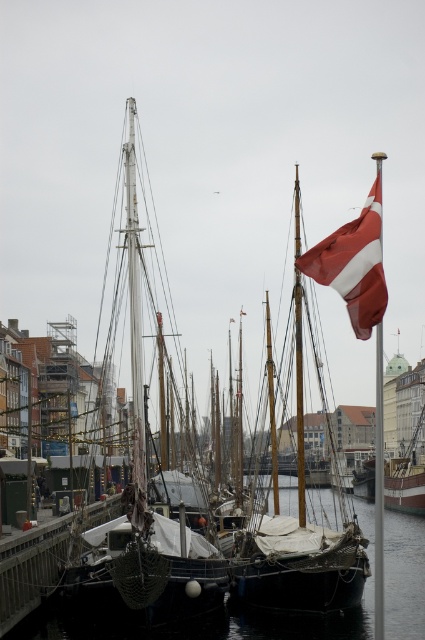
Who is positioned more to the left, red and white fabric sailboat at center or red fabric flag at upper right?

From the viewer's perspective, red and white fabric sailboat at center appears more on the left side.

Between point (297, 253) and point (333, 236), which one is positioned in front?

Point (333, 236)

Between point (255, 577) and point (348, 253), which one is positioned behind?

Point (255, 577)

This screenshot has height=640, width=425. I want to click on red and white fabric sailboat at center, so [300, 541].

Between point (322, 502) and point (317, 564), which one is positioned behind?

Point (322, 502)

Between point (408, 598) and point (297, 253), which one is positioned in front?

Positioned in front is point (297, 253).

Find the location of `transparent water at lower left`. transparent water at lower left is located at coordinates (204, 625).

Which of these two, white matte sailboat at left or red and white fabric sailboat at center, stands shorter?

Standing shorter between the two is red and white fabric sailboat at center.

Does point (217, 556) lie behind point (288, 568)?

That is True.

In order to click on white matte sailboat at left in this screenshot , I will do `click(142, 502)`.